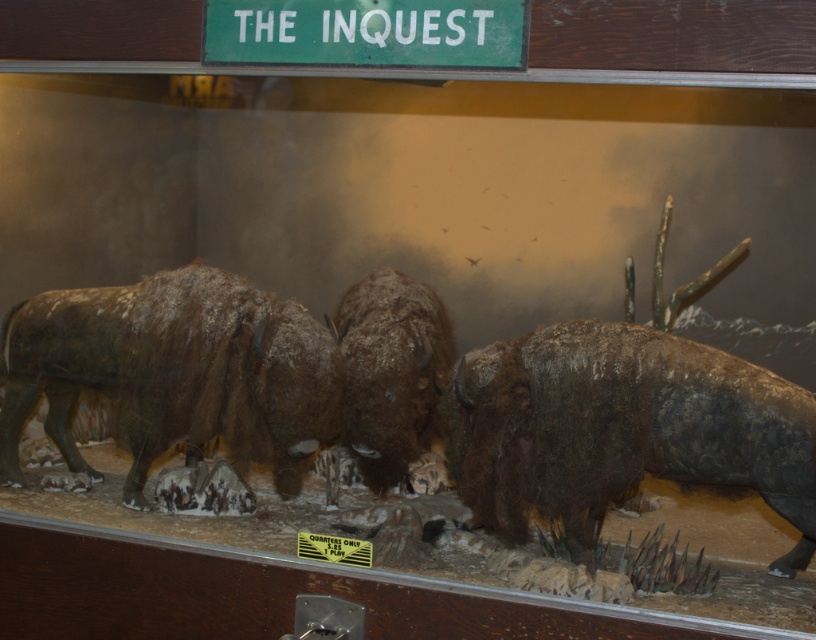
Is brown fuzzy yak at right closer to camera compared to brown fuzzy yak at left?

That is True.

Can you confirm if brown fuzzy yak at right is smaller than brown fuzzy yak at left?

Correct, brown fuzzy yak at right occupies less space than brown fuzzy yak at left.

At what (x,y) coordinates should I click in order to perform the action: click on brown fuzzy yak at right. Please return your answer as a coordinate pair (x, y). Image resolution: width=816 pixels, height=640 pixels. Looking at the image, I should click on (621, 428).

Does brown fuzzy yak at right have a lesser height compared to brown fuzzy yak at center?

Indeed, brown fuzzy yak at right has a lesser height compared to brown fuzzy yak at center.

What do you see at coordinates (621, 428) in the screenshot? The height and width of the screenshot is (640, 816). I see `brown fuzzy yak at right` at bounding box center [621, 428].

The width and height of the screenshot is (816, 640). Describe the element at coordinates (621, 428) in the screenshot. I see `brown fuzzy yak at right` at that location.

Locate an element on the screen. This screenshot has width=816, height=640. brown fuzzy yak at right is located at coordinates (621, 428).

Does point (158, 371) come in front of point (384, 483)?

Yes.

The image size is (816, 640). I want to click on brown fuzzy yak at left, so click(173, 372).